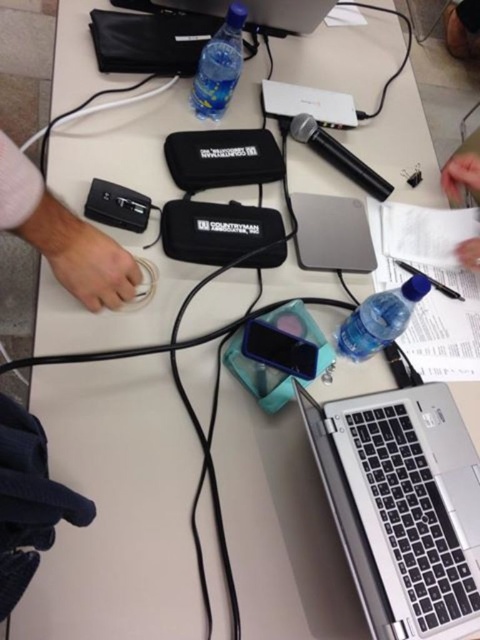
Is black matte usb hub at left shorter than white paper at upper right?

Correct, black matte usb hub at left is not as tall as white paper at upper right.

In the scene shown: Between black matte usb hub at left and white paper at upper right, which one is positioned lower?

Positioned lower is black matte usb hub at left.

Which is behind, point (97, 284) or point (468, 259)?

The point (468, 259) is more distant.

Where is `black matte usb hub at left`? The height and width of the screenshot is (640, 480). black matte usb hub at left is located at coordinates click(62, 236).

Can you confirm if blue plastic bottle at upper center is thinner than black plastic pen at right?

Indeed, blue plastic bottle at upper center has a lesser width compared to black plastic pen at right.

Between blue plastic bottle at upper center and black plastic pen at right, which one has less height?

black plastic pen at right

Which is behind, point (216, 109) or point (437, 285)?

Point (216, 109)

The height and width of the screenshot is (640, 480). I want to click on blue plastic bottle at upper center, so click(x=218, y=67).

Does silver metallic laptop at bottom right appear on the right side of silver metallic laptop at upper center?

Indeed, silver metallic laptop at bottom right is positioned on the right side of silver metallic laptop at upper center.

From the picture: Who is positioned more to the left, silver metallic laptop at bottom right or silver metallic laptop at upper center?

From the viewer's perspective, silver metallic laptop at upper center appears more on the left side.

Which is behind, point (440, 557) or point (323, 12)?

The point (323, 12) is more distant.

Image resolution: width=480 pixels, height=640 pixels. Identify the location of silver metallic laptop at bottom right. (403, 506).